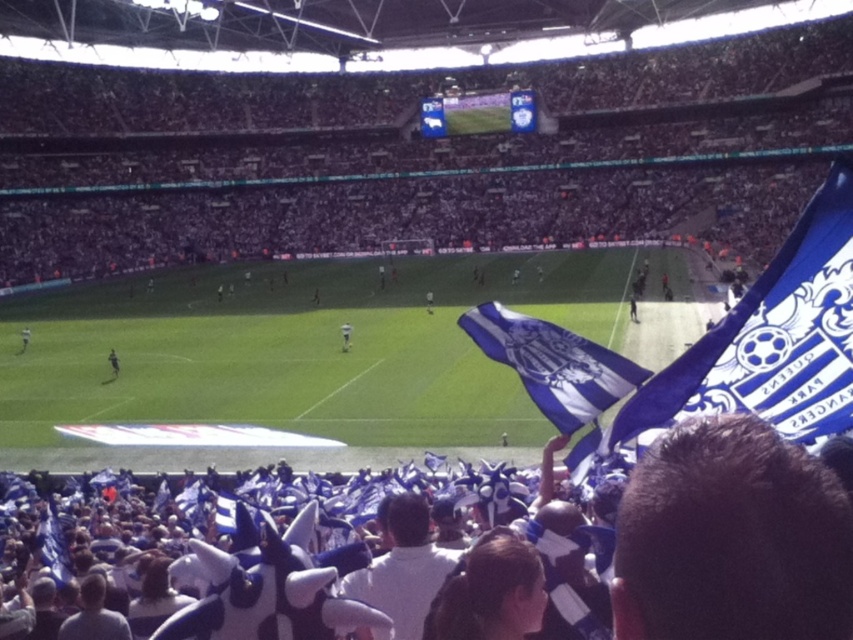
You are a photographer trying to capture a closeup of the white fabric hat at center and dark blue jersey at center. Which object should you zoom in on to ensure both are in frame without moving the camera?

The white fabric hat at center has a larger width than the dark blue jersey at center, so you should zoom in on the white fabric hat at center to ensure both objects fit within the frame.

You are a photographer at the stadium and want to capture a photo that includes both the dark blue jersey at center and the dark blue jersey at lower left. Which jersey should you position to the right in your camera view to include both?

The dark blue jersey at center is positioned on the right side of dark blue jersey at lower left, so to include both in the photo, you should position the dark blue jersey at center to the right in your camera view.

You are a photographer standing at the edge of the field. You want to take a photo that includes both the dark blue jersey at center and the dark blue jersey at lower left. Which jersey should you adjust your camera angle to focus on first to ensure both are in frame?

The dark blue jersey at center is located below the dark blue jersey at lower left. To capture both in the frame, you should focus on the dark blue jersey at lower left first, as it is higher up, ensuring you can adjust downward to include the one below.